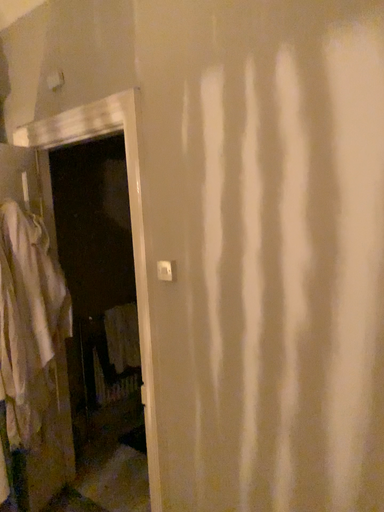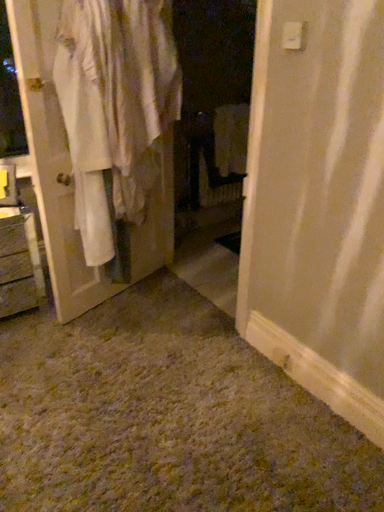
Question: Which way did the camera rotate in the video?

Choices:
 (A) rotated right
 (B) rotated left

Answer: (B)